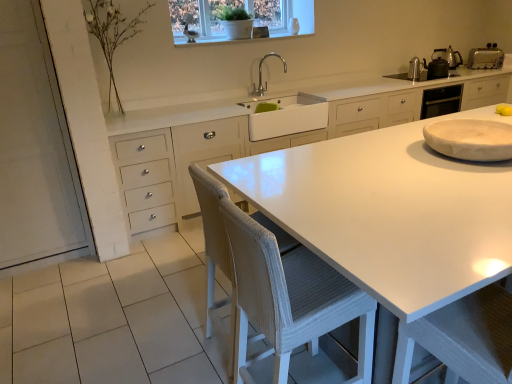
You are a GUI agent. You are given a task and a screenshot of the screen. Output one action in this format:
    pyautogui.click(x=<x>, y=<y>)
    Task: Click on the vacant space behind yellow matte lemon at upper right
    The image size is (512, 384).
    Given the screenshot: What is the action you would take?
    pyautogui.click(x=489, y=114)